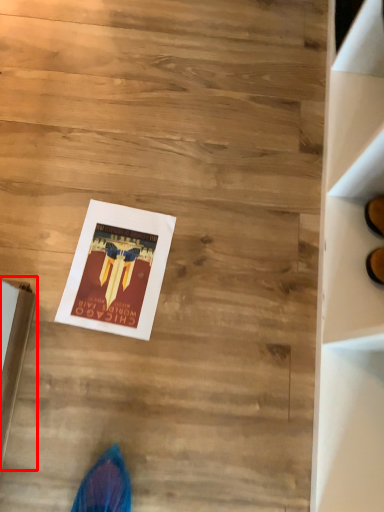
Question: From the image's perspective, what is the correct spatial positioning of cardboard box (annotated by the red box) in reference to magazine?

Choices:
 (A) above
 (B) below

Answer: (B)